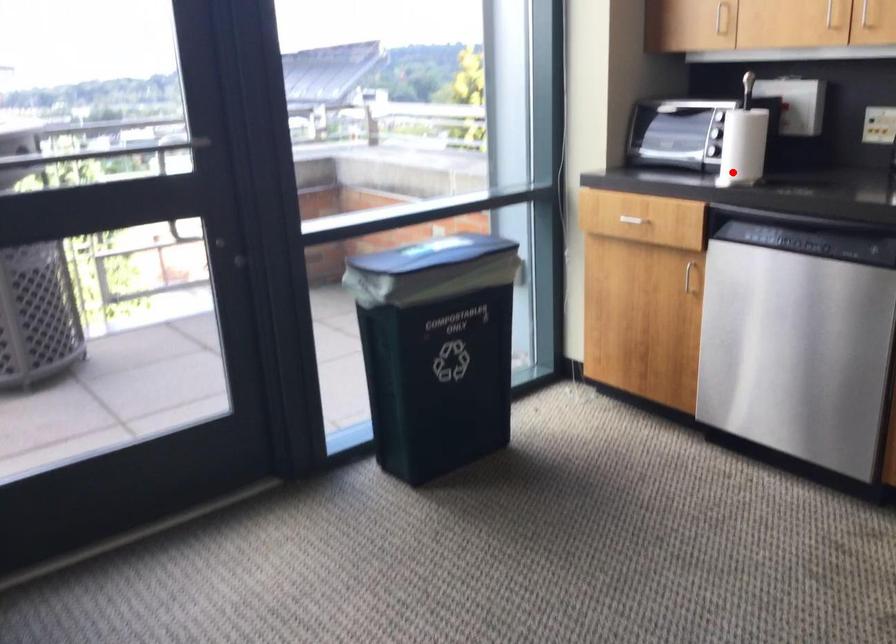
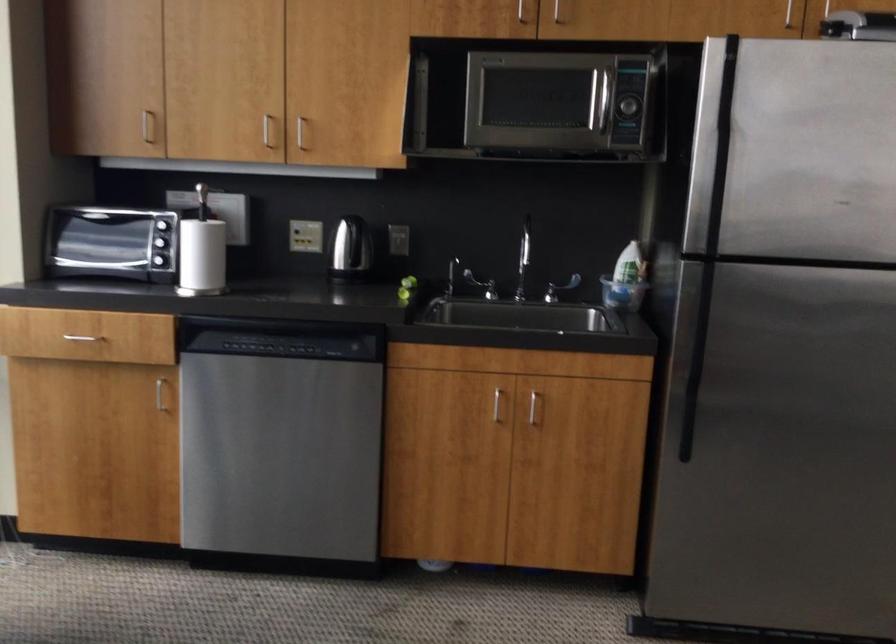
The point at the highlighted location is marked in the first image. Where is the corresponding point in the second image?

(202, 281)